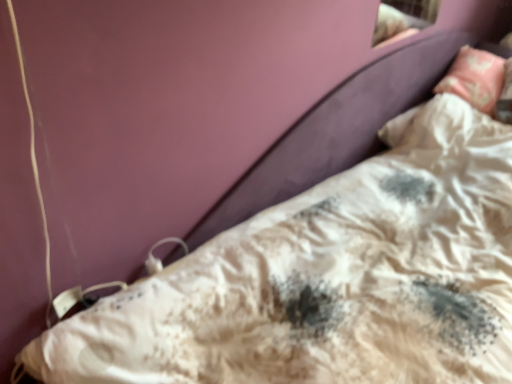
What do you see at coordinates (401, 22) in the screenshot?
I see `transparent glass window at upper right` at bounding box center [401, 22].

Locate an element on the screen. This screenshot has width=512, height=384. transparent glass window at upper right is located at coordinates (401, 22).

Where is `transparent glass window at upper right`? This screenshot has width=512, height=384. transparent glass window at upper right is located at coordinates (401, 22).